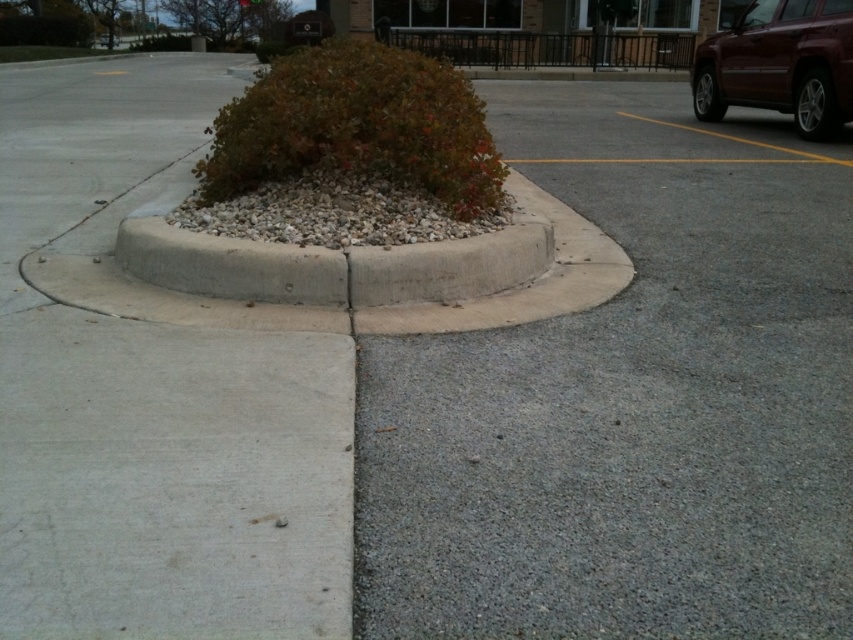
Which is behind, point (653, 195) or point (294, 83)?

Point (653, 195)

You are a GUI agent. You are given a task and a screenshot of the screen. Output one action in this format:
    pyautogui.click(x=<x>, y=<y>)
    Task: Click on the gray asphalt at lower right
    Image resolution: width=853 pixels, height=640 pixels.
    Given the screenshot: What is the action you would take?
    pyautogui.click(x=630, y=400)

Is point (619, 561) farther from camera compared to point (426, 145)?

That is False.

At what (x,y) coordinates should I click in order to perform the action: click on gray asphalt at lower right. Please return your answer as a coordinate pair (x, y). This screenshot has height=640, width=853. Looking at the image, I should click on point(630,400).

Which is in front, point (386, 145) or point (804, 76)?

Point (386, 145) is more forward.

Does green leafy bush at center have a greater height compared to shiny maroon suv at upper right?

No, green leafy bush at center is not taller than shiny maroon suv at upper right.

The width and height of the screenshot is (853, 640). What do you see at coordinates (358, 125) in the screenshot?
I see `green leafy bush at center` at bounding box center [358, 125].

Find the location of a particular element. This screenshot has height=640, width=853. green leafy bush at center is located at coordinates point(358,125).

Can you confirm if gray asphalt at lower right is smaller than shiny maroon suv at upper right?

No.

Who is more forward, (376, 474) or (850, 68)?

Point (376, 474) is in front.

Is point (428, 500) in front of point (813, 90)?

That is True.

The width and height of the screenshot is (853, 640). In order to click on gray asphalt at lower right in this screenshot , I will do `click(630, 400)`.